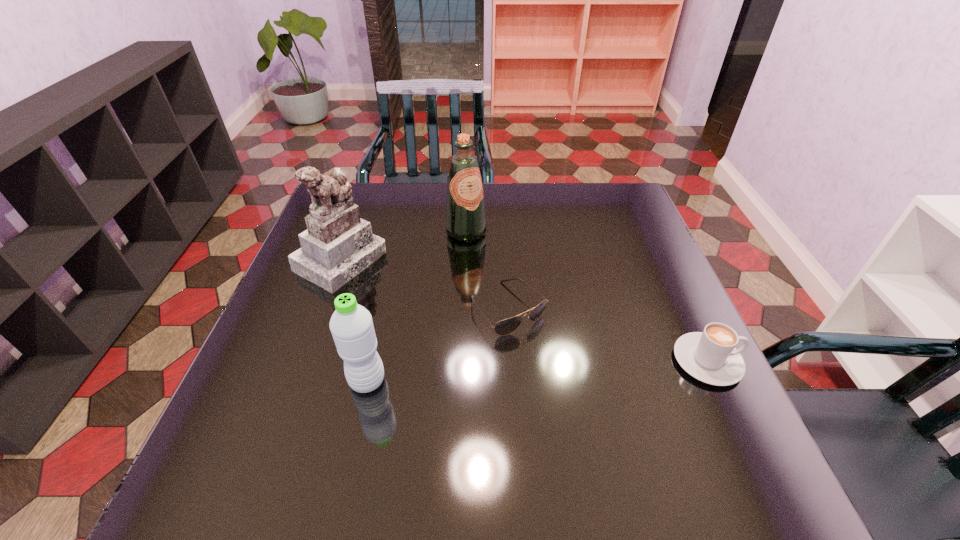
The width and height of the screenshot is (960, 540). Identify the location of vacant space at the near edge of the desktop. (519, 407).

Where is `vacant space at the left edge of the desktop`? vacant space at the left edge of the desktop is located at coordinates (296, 301).

In the image, there is a desktop. What are the coordinates of `free space at the right edge` in the screenshot? It's located at (635, 249).

Locate an element on the screen. The image size is (960, 540). free region at the far right corner of the desktop is located at coordinates (632, 194).

I want to click on empty space that is in between the sunglasses and the figurine, so click(424, 284).

Where is `free spot between the rightmost object and the olive oil`? The height and width of the screenshot is (540, 960). free spot between the rightmost object and the olive oil is located at coordinates (587, 296).

Locate an element on the screen. free space between the olive oil and the figurine is located at coordinates (403, 246).

You are a GUI agent. You are given a task and a screenshot of the screen. Output one action in this format:
    pyautogui.click(x=<x>, y=<y>)
    Task: Click on the free area in between the rightmost object and the shortest object
    
    Given the screenshot: What is the action you would take?
    click(608, 335)

Where is `free spot between the water bottle and the second shortest object`? free spot between the water bottle and the second shortest object is located at coordinates (538, 371).

At what (x,y) coordinates should I click in order to perform the action: click on empty location between the shortest object and the third tallest object. Please return your answer as a coordinate pair (x, y). Looking at the image, I should click on (438, 345).